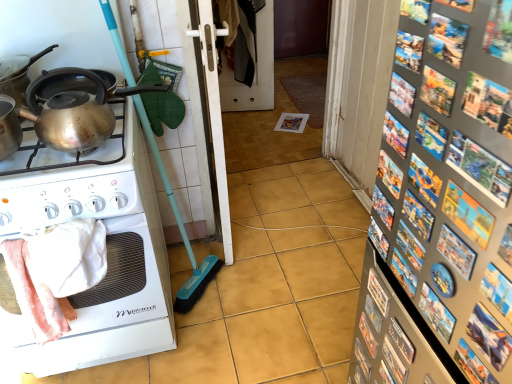
Question: Can you see white plastic screen door at center, positioned as the second screen door in back-to-front order, touching shiny metallic kettle at upper left?

Choices:
 (A) no
 (B) yes

Answer: (A)

Question: Does white plastic screen door at center, placed as the 1th screen door when sorted from front to back, have a greater height compared to shiny metallic kettle at upper left?

Choices:
 (A) no
 (B) yes

Answer: (B)

Question: From a real-world perspective, is white plastic screen door at center, placed as the 1th screen door when sorted from front to back, located higher than shiny metallic kettle at upper left?

Choices:
 (A) no
 (B) yes

Answer: (A)

Question: Does white plastic screen door at center, placed as the 1th screen door when sorted from front to back, have a smaller size compared to shiny metallic kettle at upper left?

Choices:
 (A) no
 (B) yes

Answer: (A)

Question: Considering the relative sizes of white plastic screen door at center, placed as the 1th screen door when sorted from front to back, and shiny metallic kettle at upper left in the image provided, is white plastic screen door at center, placed as the 1th screen door when sorted from front to back, wider than shiny metallic kettle at upper left?

Choices:
 (A) no
 (B) yes

Answer: (A)

Question: Is white plastic screen door at center, positioned as the second screen door in back-to-front order, outside shiny metallic kettle at upper left?

Choices:
 (A) yes
 (B) no

Answer: (A)

Question: Does metallic silver magnets at right have a greater width compared to white plastic screen door at center, positioned as the 1th screen door in back-to-front order?

Choices:
 (A) no
 (B) yes

Answer: (B)

Question: Considering the relative positions of metallic silver magnets at right and white plastic screen door at center, the 2th screen door positioned from the front, in the image provided, is metallic silver magnets at right to the right of white plastic screen door at center, the 2th screen door positioned from the front, from the viewer's perspective?

Choices:
 (A) yes
 (B) no

Answer: (A)

Question: From the image's perspective, is metallic silver magnets at right on top of white plastic screen door at center, the 2th screen door positioned from the front?

Choices:
 (A) no
 (B) yes

Answer: (A)

Question: From a real-world perspective, is metallic silver magnets at right below white plastic screen door at center, the 2th screen door positioned from the front?

Choices:
 (A) yes
 (B) no

Answer: (B)

Question: From a real-world perspective, is metallic silver magnets at right on top of white plastic screen door at center, the 2th screen door positioned from the front?

Choices:
 (A) no
 (B) yes

Answer: (B)

Question: Is the depth of metallic silver magnets at right greater than that of white plastic screen door at center, the 2th screen door positioned from the front?

Choices:
 (A) no
 (B) yes

Answer: (A)

Question: From the image's perspective, is shiny metallic kettle at upper left under white glossy stove at left?

Choices:
 (A) yes
 (B) no

Answer: (B)